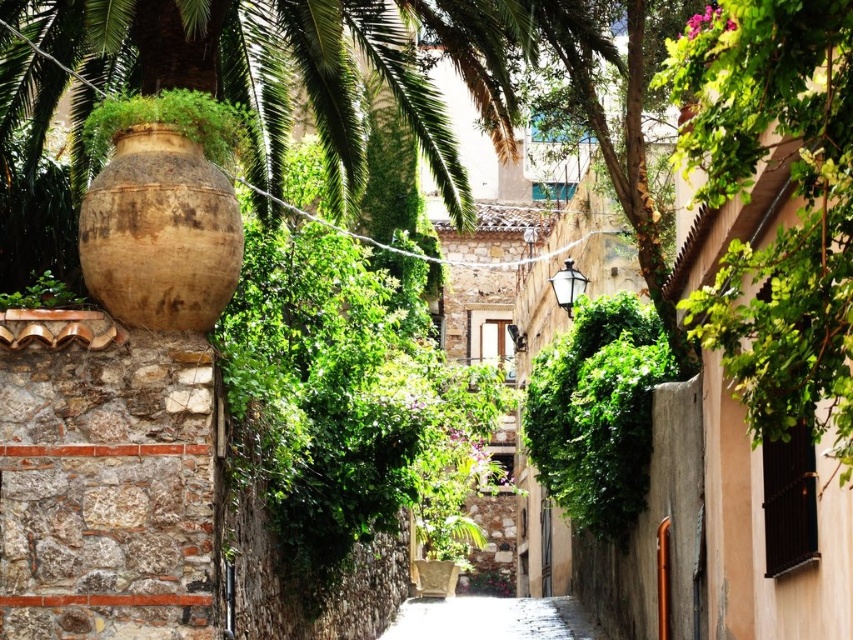
Which is behind, point (578, 460) or point (560, 618)?

Point (560, 618)

Can you confirm if green leafy plant at center is taller than smooth stone alley at center?

In fact, green leafy plant at center may be shorter than smooth stone alley at center.

Which is behind, point (572, 372) or point (463, 612)?

The point (463, 612) is behind.

The height and width of the screenshot is (640, 853). In order to click on green leafy plant at center in this screenshot , I will do `click(596, 412)`.